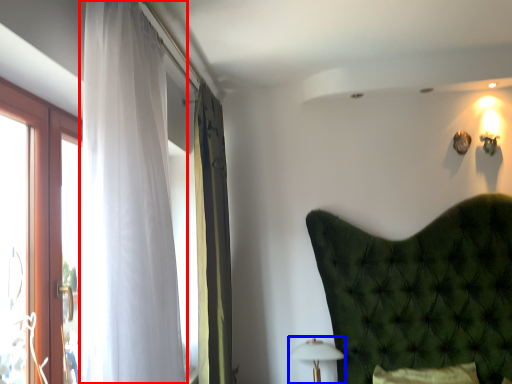
Question: Which of the following is the farthest to the observer, curtain (highlighted by a red box) or table lamp (highlighted by a blue box)?

Choices:
 (A) curtain
 (B) table lamp

Answer: (B)